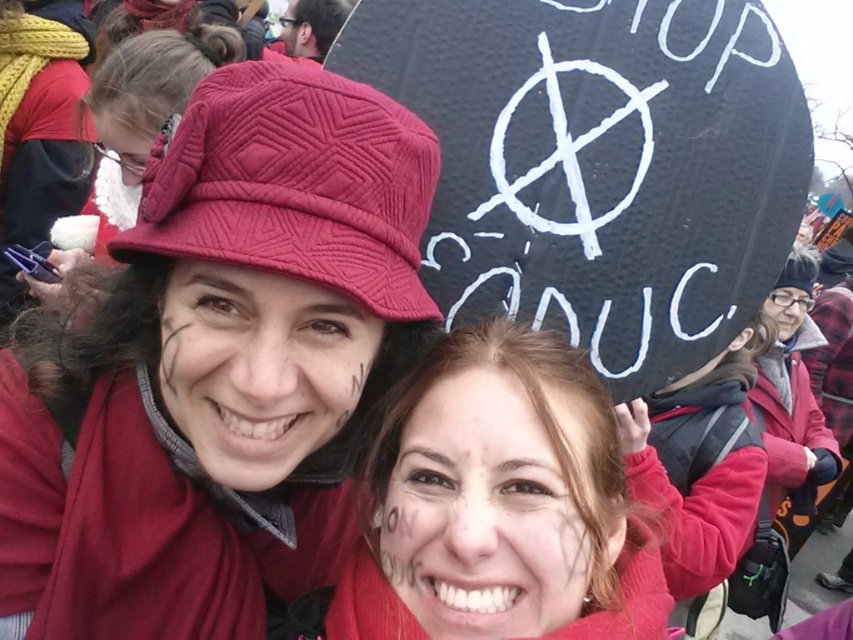
Question: Does matte red scarf at center have a smaller size compared to quilted fabric hat at upper center?

Choices:
 (A) yes
 (B) no

Answer: (A)

Question: Does matte red hat at upper left lie behind black cardboard sign at upper center?

Choices:
 (A) no
 (B) yes

Answer: (A)

Question: Which point is closer to the camera taking this photo?

Choices:
 (A) tap(102, 218)
 (B) tap(273, 140)

Answer: (B)

Question: Which object is farther from the camera taking this photo?

Choices:
 (A) matte red scarf at center
 (B) matte red hat at upper left

Answer: (A)

Question: Can you confirm if matte red hat at upper left is thinner than matte red scarf at center?

Choices:
 (A) yes
 (B) no

Answer: (B)

Question: Which object is closer to the camera taking this photo?

Choices:
 (A) black cardboard sign at upper center
 (B) matte red scarf at center
 (C) quilted fabric hat at upper center
 (D) matte red hat at upper left

Answer: (D)